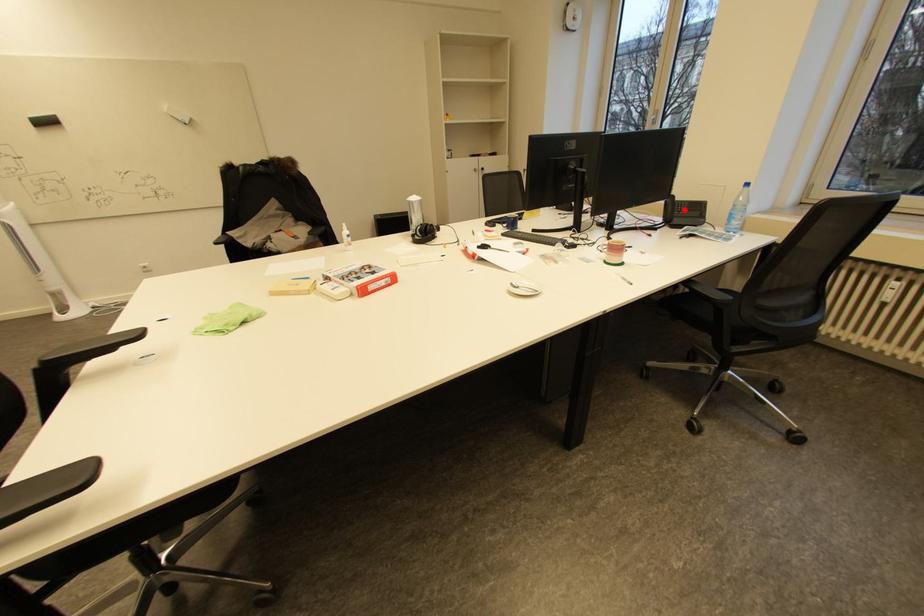
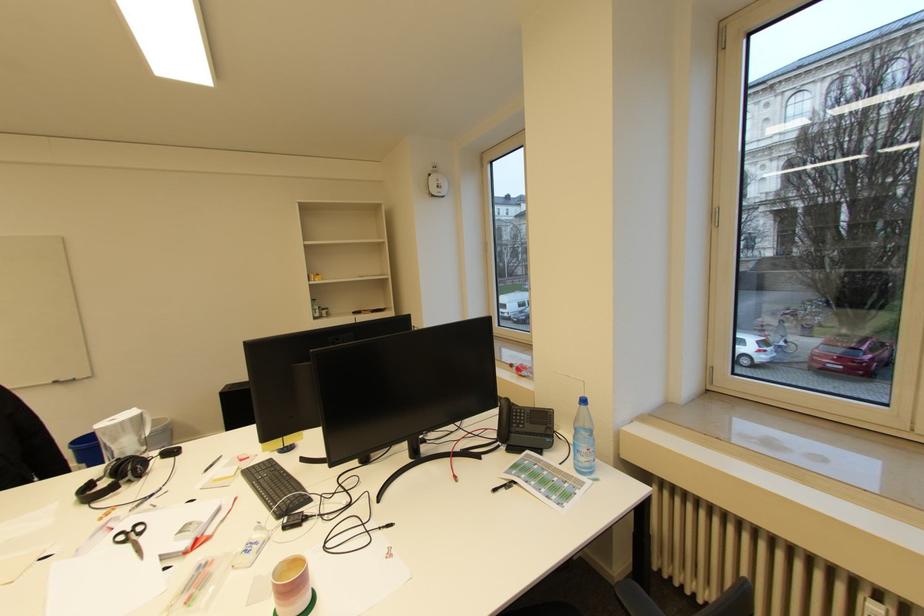
Where in the second image is the point corresponding to the highlighted location from the first image?

(523, 419)